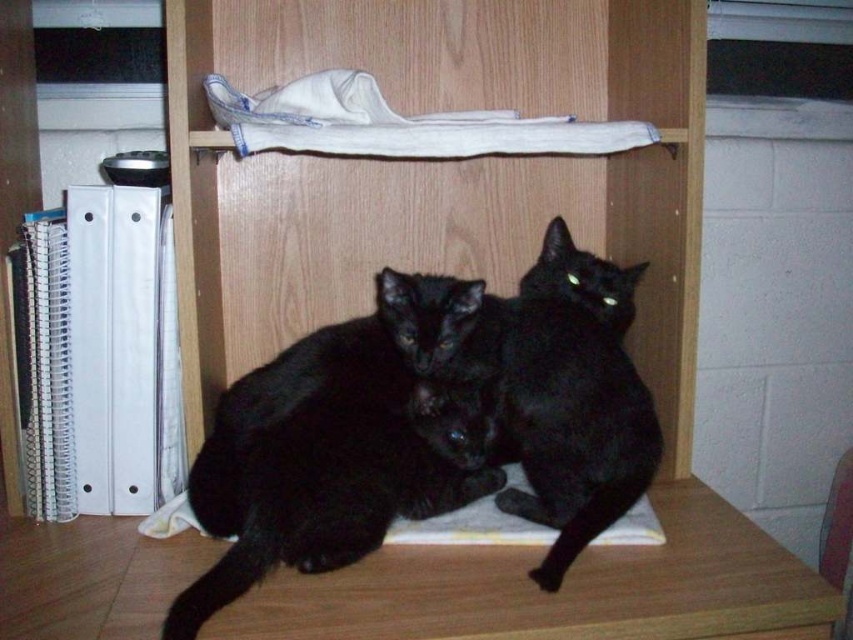
You are a toy mouse that is 30 cm long. You want to place yourself between the wooden bookshelf at center and the black fur cat at center so that you can be seen by both. Is there enough space for you to fit there?

The wooden bookshelf at center is wider than the black fur cat at center. Since the toy mouse is 30 cm long, there should be enough space between them to fit as the distance is greater than the mouse length.

You are organizing items on a wooden shelf and see the wooden bookshelf at center and the black matte fur cat at center. Which object is positioned to the right of the other?

The wooden bookshelf at center is to the right of the black matte fur cat at center.

You are standing in front of the wooden shelf where the two black cats are sitting. There are two points marked on the shelf. The first point is at coordinates point (x=413, y=620) and the second point is at point (x=321, y=561). If you want to place a small treat closer to you, which point should you choose?

Point (x=413, y=620) is closer to the viewer than point (x=321, y=561), so you should choose point (x=413, y=620) to place the small treat closer to you.